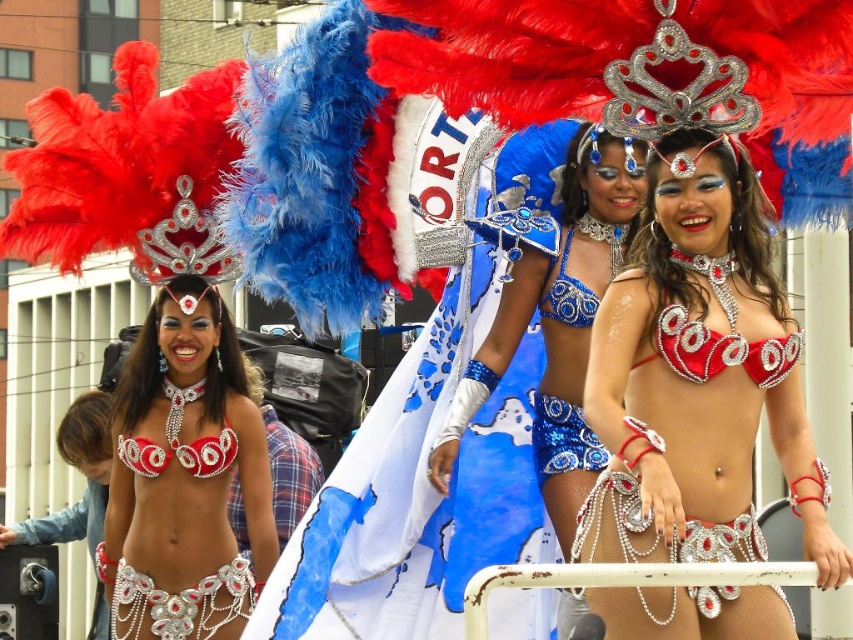
You are a photographer positioned at the front of the stage, and you want to capture both the shiny red bikini at center and the shiny blue bikini top at center in your shot. Which one will appear larger in your photo?

The shiny red bikini at center will appear larger in the photo because it is closer to the viewer than the shiny blue bikini top at center.

You are a costume designer observing the performers. You need to determine which bikini top is wider between the matte silver bikini top at left and the shiny blue sequins bikini top at center. Which one is wider?

The matte silver bikini top at left is wider than the shiny blue sequins bikini top at center.